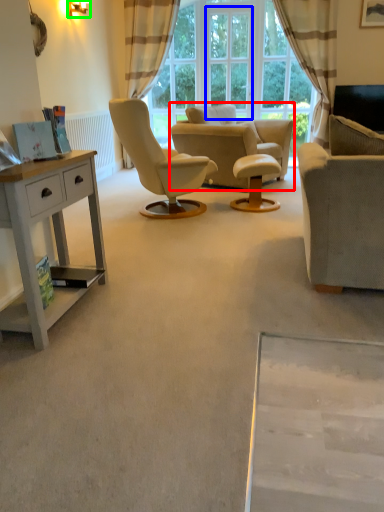
Question: Considering the real-world distances, which object is closest to chair (highlighted by a red box)? window screen (highlighted by a blue box) or lamp (highlighted by a green box).

Choices:
 (A) window screen
 (B) lamp

Answer: (A)